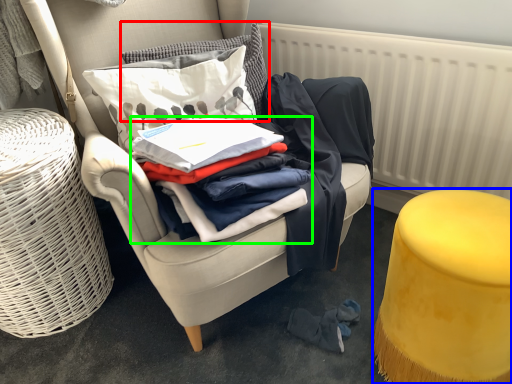
Question: Which is nearer to the pillow (highlighted by a red box)? stool (highlighted by a blue box) or clothing (highlighted by a green box).

Choices:
 (A) stool
 (B) clothing

Answer: (B)